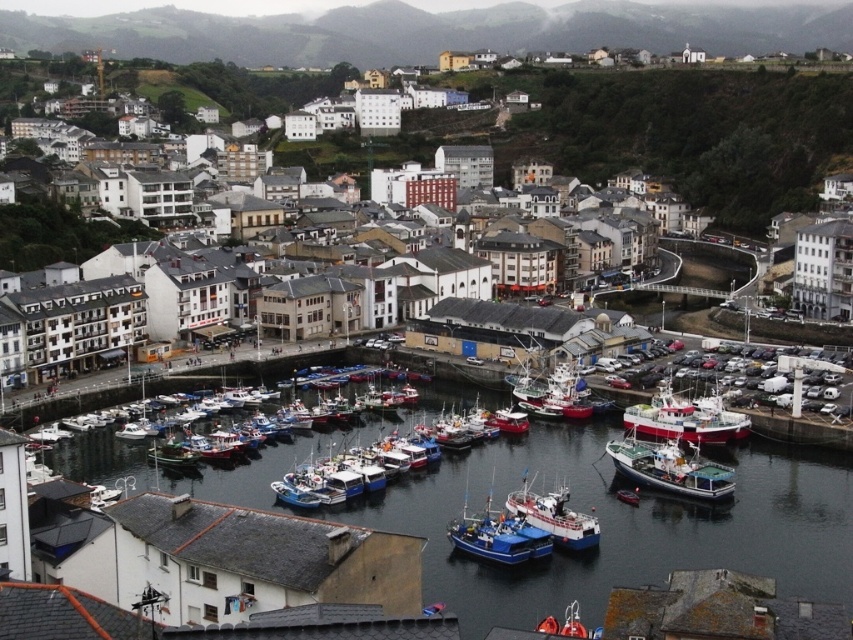
Which is below, white wooden boat at lower right or blue painted wooden boat at center?

blue painted wooden boat at center is below.

Is point (624, 456) less distant than point (460, 545)?

No, (624, 456) is further to viewer.

Is point (676, 454) behind point (457, 524)?

Yes, point (676, 454) is farther from viewer.

Find the location of `white wooden boat at lower right`. white wooden boat at lower right is located at coordinates (670, 468).

Does smooth water at center have a larger size compared to white matte buildings at center?

Actually, smooth water at center might be smaller than white matte buildings at center.

Is smooth water at center shorter than white matte buildings at center?

Yes, smooth water at center is shorter than white matte buildings at center.

Which is behind, point (541, 465) or point (109, 166)?

Positioned behind is point (109, 166).

The image size is (853, 640). I want to click on smooth water at center, so click(621, 524).

You are a GUI agent. You are given a task and a screenshot of the screen. Output one action in this format:
    pyautogui.click(x=<x>, y=<y>)
    Task: Click on the white matte buildings at center
    Image resolution: width=853 pixels, height=640 pixels.
    Given the screenshot: What is the action you would take?
    pyautogui.click(x=51, y=221)

Which is in front, point (254, 221) or point (515, 496)?

Point (515, 496) is in front.

Image resolution: width=853 pixels, height=640 pixels. Identify the location of white matte buildings at center. (51, 221).